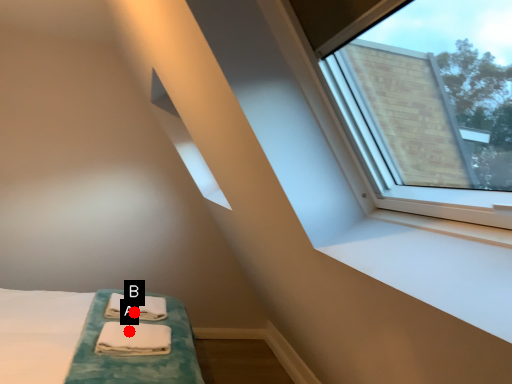
Question: Two points are circled on the image, labeled by A and B beside each circle. Which point appears farthest from the camera in this image?

Choices:
 (A) A is further
 (B) B is further

Answer: (B)